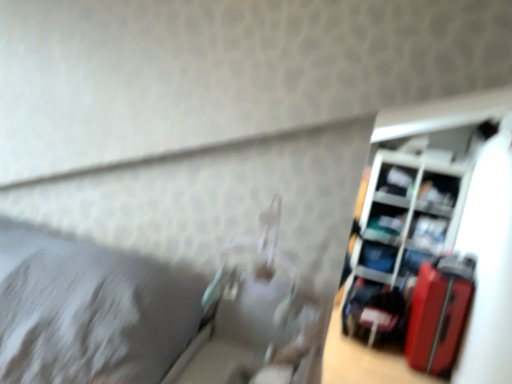
Question: Based on their positions, is matte plastic shelf at right, the second shelf from the bottom, located to the left or right of shiny red suitcase at right?

Choices:
 (A) right
 (B) left

Answer: (A)

Question: Considering the positions of matte plastic shelf at right, arranged as the fourth shelf when viewed from the top, and shiny red suitcase at right in the image, is matte plastic shelf at right, arranged as the fourth shelf when viewed from the top, bigger or smaller than shiny red suitcase at right?

Choices:
 (A) small
 (B) big

Answer: (B)

Question: Based on their relative distances, which object is nearer to the matte plastic shelf at upper right, the third shelf from the bottom?

Choices:
 (A) shiny red suitcase at right
 (B) matte plastic shelf at right, the second shelf from the bottom
 (C) matte black laptop at right, the 5th shelf in the top-to-bottom sequence
 (D) matte black shelf at upper right, the second shelf in the top-to-bottom sequence
 (E) black plastic shelf at upper right, the 5th shelf ordered from the bottom

Answer: (D)

Question: Based on their relative distances, which object is farther from the matte plastic shelf at right, arranged as the fourth shelf when viewed from the top?

Choices:
 (A) black plastic shelf at upper right, which ranks as the 1th shelf in top-to-bottom order
 (B) matte black laptop at right, which is the 1th shelf in bottom-to-top order
 (C) shiny red suitcase at right
 (D) matte plastic shelf at upper right, placed as the 3th shelf when sorted from top to bottom
 (E) matte black shelf at upper right, the second shelf in the top-to-bottom sequence

Answer: (C)